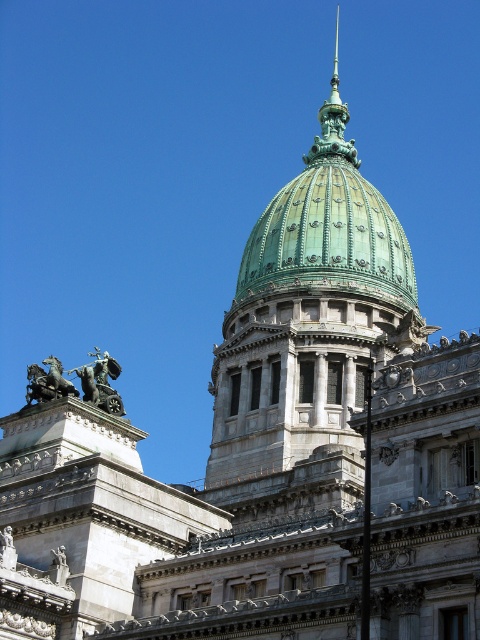
Looking at this image, you are an architect examining the building. You notice two domes labeled green polished dome at center and green patina dome at center. Which one is positioned higher in the structure?

The green polished dome at center is positioned higher than the green patina dome at center because it is described as being above it.

You are standing in front of the grand neoclassical building and want to determine which of the two points, point (337, 420) or point (345, 186), is closer to you. Based on the image, which point is nearer?

Point (337, 420) is closer to the viewer than point (345, 186).

Consider the image. You are standing in front of a neoclassical building and want to take a photo of the green polished dome at center. If your camera can focus on objects up to 50 meters away, will you need to move closer or farther away to get a clear shot?

The green polished dome at center is 50.63 meters from viewer. Since the camera can focus up to 50 meters, you need to move closer to ensure it falls within the camera range.